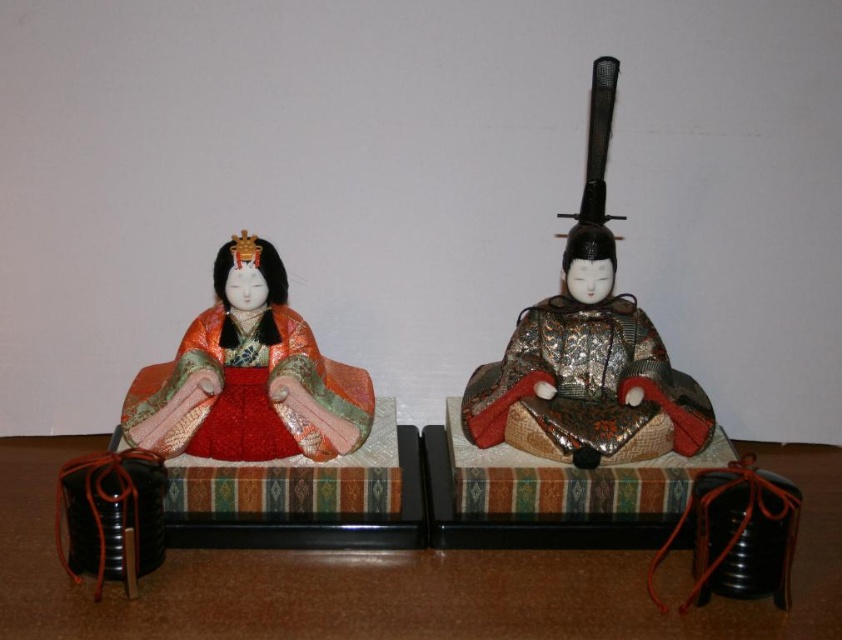
You are a collector of antique dolls and you have a display shelf that can only hold items placed to the left of a central divider. You see the metallic gold armor at right and the matte gold kimono at left in the image. Can both dolls fit on your shelf if you need to place them according to their positions in the image?

The metallic gold armor at right is to the right of the matte gold kimono at left. Since the display shelf can only hold items to the left of the central divider, placing the metallic gold armor at right to the right would not fit within the shelf constraints. Therefore, only the matte gold kimono at left can be placed on the shelf.

You are a toy collector who wants to place a new 12 inch tall doll on the shelf between the metallic gold armor at right and the matte gold kimono at left. Is there enough space between them to fit this new doll?

The distance between the metallic gold armor at right and the matte gold kimono at left is 11.84 inches. Since the new doll is 12 inches tall, it would not fit in the available space between them.

You are a collector of dolls and want to display both the metallic gold armor at right and the matte gold kimono at left on a shelf. If the shelf has a height limit of 1 meter, will both dolls fit without exceeding the height limit?

The metallic gold armor at right is taller than the matte gold kimono at left, but since the height limit is 1 meter, both dolls will fit as long as each individual doll does not exceed the limit. However, the description only states their relative heights, not their exact measurements. Without specific heights, we cannot confirm if they fit within the 1 meter limit individually.